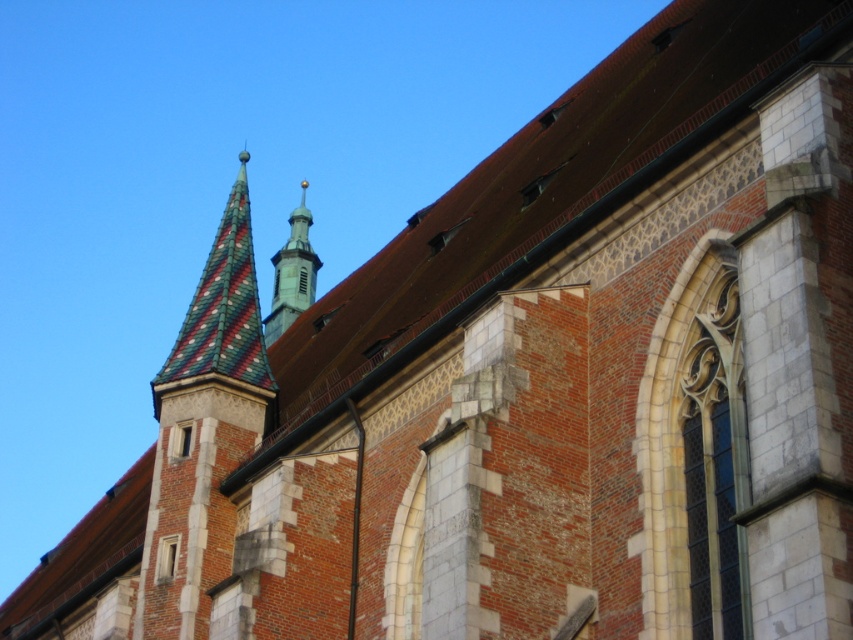
Can you confirm if multicolored tiled spire at upper left is smaller than smooth gold spire at center?

Correct, multicolored tiled spire at upper left occupies less space than smooth gold spire at center.

Which is more to the right, multicolored tiled spire at upper left or smooth gold spire at center?

Positioned to the right is multicolored tiled spire at upper left.

Between point (244, 193) and point (279, 324), which one is positioned in front?

Point (244, 193) is in front.

Find the location of a particular element. The image size is (853, 640). multicolored tiled spire at upper left is located at coordinates (202, 432).